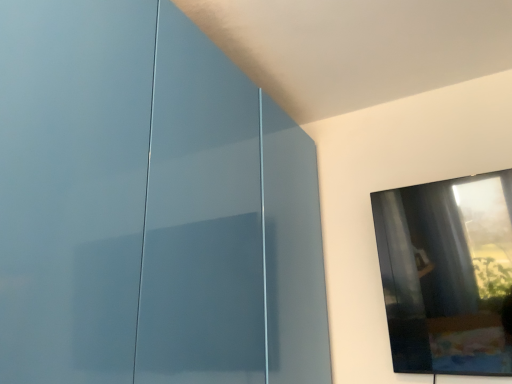
What do you see at coordinates (150, 207) in the screenshot? The width and height of the screenshot is (512, 384). I see `glossy blue glass door at left` at bounding box center [150, 207].

Find the location of a particular element. glossy blue glass door at left is located at coordinates (150, 207).

Describe the element at coordinates (447, 273) in the screenshot. I see `transparent glass window at upper right` at that location.

What is the approximate height of transparent glass window at upper right?

The height of transparent glass window at upper right is 27.89 inches.

Identify the location of transparent glass window at upper right. (447, 273).

The width and height of the screenshot is (512, 384). I want to click on glossy blue glass door at left, so click(150, 207).

Is glossy blue glass door at left to the left or to the right of transparent glass window at upper right in the image?

From the image, it's evident that glossy blue glass door at left is to the left of transparent glass window at upper right.

Is glossy blue glass door at left closer to camera compared to transparent glass window at upper right?

Yes, glossy blue glass door at left is in front of transparent glass window at upper right.

Is point (241, 142) farther from viewer compared to point (444, 214)?

No, it is not.

From the image's perspective, which one is positioned higher, glossy blue glass door at left or transparent glass window at upper right?

glossy blue glass door at left is shown above in the image.

From a real-world perspective, which object rests below the other?

In real-world perspective, transparent glass window at upper right is lower.

Does glossy blue glass door at left have a lesser width compared to transparent glass window at upper right?

No.

Which of these two, glossy blue glass door at left or transparent glass window at upper right, stands shorter?

With less height is transparent glass window at upper right.

Considering the sizes of glossy blue glass door at left and transparent glass window at upper right in the image, is glossy blue glass door at left bigger or smaller than transparent glass window at upper right?

glossy blue glass door at left is bigger than transparent glass window at upper right.

Is glossy blue glass door at left located outside transparent glass window at upper right?

Yes.

Is glossy blue glass door at left beside transparent glass window at upper right?

There is a gap between glossy blue glass door at left and transparent glass window at upper right.

Could you tell me if glossy blue glass door at left is turned towards transparent glass window at upper right?

Yes, glossy blue glass door at left is turned towards transparent glass window at upper right.

What's the angular difference between glossy blue glass door at left and transparent glass window at upper right's facing directions?

glossy blue glass door at left and transparent glass window at upper right are facing 91 degrees away from each other.

At what (x,y) coordinates should I click in order to perform the action: click on window located below the glossy blue glass door at left (from the image's perspective). Please return your answer as a coordinate pair (x, y). This screenshot has height=384, width=512. Looking at the image, I should click on (447, 273).

Based on the photo, in the image, is transparent glass window at upper right on the left side or the right side of glossy blue glass door at left?

In the image, transparent glass window at upper right appears on the right side of glossy blue glass door at left.

Which object is further away from the camera, transparent glass window at upper right or glossy blue glass door at left?

transparent glass window at upper right is further away from the camera.

Between point (492, 178) and point (114, 18), which one is positioned behind?

The point (492, 178) is farther.

From the image's perspective, is transparent glass window at upper right below glossy blue glass door at left?

Yes.

From a real-world perspective, who is located lower, transparent glass window at upper right or glossy blue glass door at left?

In real-world perspective, transparent glass window at upper right is lower.

Can you confirm if transparent glass window at upper right is thinner than glossy blue glass door at left?

Yes.

Considering the sizes of transparent glass window at upper right and glossy blue glass door at left in the image, is transparent glass window at upper right taller or shorter than glossy blue glass door at left?

In the image, transparent glass window at upper right appears to be shorter than glossy blue glass door at left.

Considering the sizes of transparent glass window at upper right and glossy blue glass door at left in the image, is transparent glass window at upper right bigger or smaller than glossy blue glass door at left?

transparent glass window at upper right is smaller than glossy blue glass door at left.

Is transparent glass window at upper right outside of glossy blue glass door at left?

Yes.

Are transparent glass window at upper right and glossy blue glass door at left making contact?

No, transparent glass window at upper right is not touching glossy blue glass door at left.

Does transparent glass window at upper right turn towards glossy blue glass door at left?

No, transparent glass window at upper right does not turn towards glossy blue glass door at left.

How different are the orientations of transparent glass window at upper right and glossy blue glass door at left in degrees?

transparent glass window at upper right and glossy blue glass door at left are facing 91 degrees away from each other.

Locate an element on the screen. The image size is (512, 384). glass door in front of the transparent glass window at upper right is located at coordinates (150, 207).

Locate an element on the screen. This screenshot has width=512, height=384. window behind the glossy blue glass door at left is located at coordinates (447, 273).

The width and height of the screenshot is (512, 384). I want to click on window below the glossy blue glass door at left (from a real-world perspective), so click(447, 273).